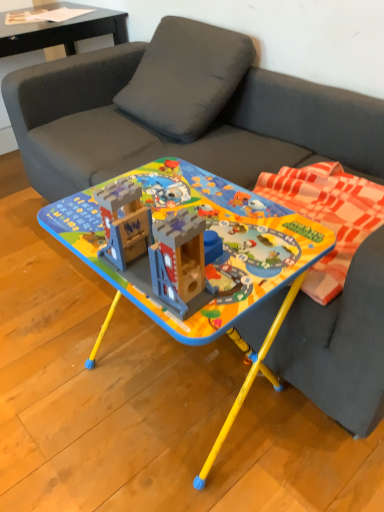
Question: From a real-world perspective, relative to plaid fabric blanket at right, is matte plastic table at center, acting as the 2th table starting from the top, vertically above or below?

Choices:
 (A) above
 (B) below

Answer: (B)

Question: Considering the positions of matte plastic table at center, acting as the 1th table starting from the front, and plaid fabric blanket at right in the image, is matte plastic table at center, acting as the 1th table starting from the front, taller or shorter than plaid fabric blanket at right?

Choices:
 (A) tall
 (B) short

Answer: (A)

Question: Which is nearer to the plaid fabric blanket at right?

Choices:
 (A) black glossy side table at upper left
 (B) matte black paper at upper left, which is the 2th table in front-to-back order
 (C) matte plastic table at center, acting as the 1th table starting from the front

Answer: (C)

Question: Which of these objects is positioned farthest from the matte plastic table at center, marked as the second table in a back-to-front arrangement?

Choices:
 (A) plaid fabric blanket at right
 (B) matte black paper at upper left, acting as the 2th table starting from the bottom
 (C) black glossy side table at upper left

Answer: (B)